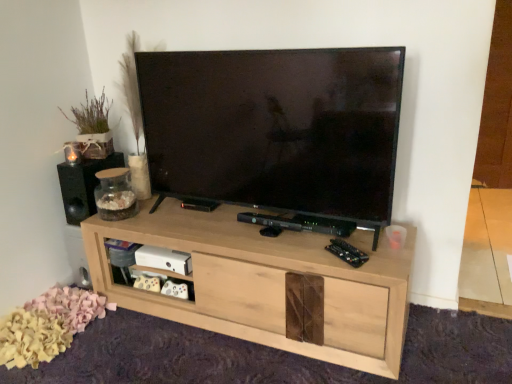
Question: Is black matte speaker at left further to camera compared to natural wood cabinet at center?

Choices:
 (A) no
 (B) yes

Answer: (B)

Question: Would you say natural wood cabinet at center is part of black matte speaker at left's contents?

Choices:
 (A) yes
 (B) no

Answer: (B)

Question: Is black matte speaker at left oriented towards natural wood cabinet at center?

Choices:
 (A) no
 (B) yes

Answer: (A)

Question: Can you confirm if black matte speaker at left is shorter than natural wood cabinet at center?

Choices:
 (A) yes
 (B) no

Answer: (A)

Question: From the image's perspective, is black matte speaker at left above natural wood cabinet at center?

Choices:
 (A) no
 (B) yes

Answer: (B)

Question: From a real-world perspective, is black matte speaker at left located higher than natural wood cabinet at center?

Choices:
 (A) yes
 (B) no

Answer: (A)

Question: Can black matte speaker at left be found inside natural wood cabinet at center?

Choices:
 (A) yes
 (B) no

Answer: (B)

Question: From a real-world perspective, is natural wood cabinet at center below black matte speaker at left?

Choices:
 (A) yes
 (B) no

Answer: (A)

Question: Would you say natural wood cabinet at center is outside black matte speaker at left?

Choices:
 (A) yes
 (B) no

Answer: (A)

Question: Is natural wood cabinet at center at the right side of black matte speaker at left?

Choices:
 (A) yes
 (B) no

Answer: (A)

Question: Is natural wood cabinet at center in front of black matte speaker at left?

Choices:
 (A) no
 (B) yes

Answer: (B)

Question: Can you confirm if natural wood cabinet at center is smaller than black matte speaker at left?

Choices:
 (A) no
 (B) yes

Answer: (A)

Question: Is black matte speaker at left inside the boundaries of natural wood cabinet at center, or outside?

Choices:
 (A) outside
 (B) inside

Answer: (A)